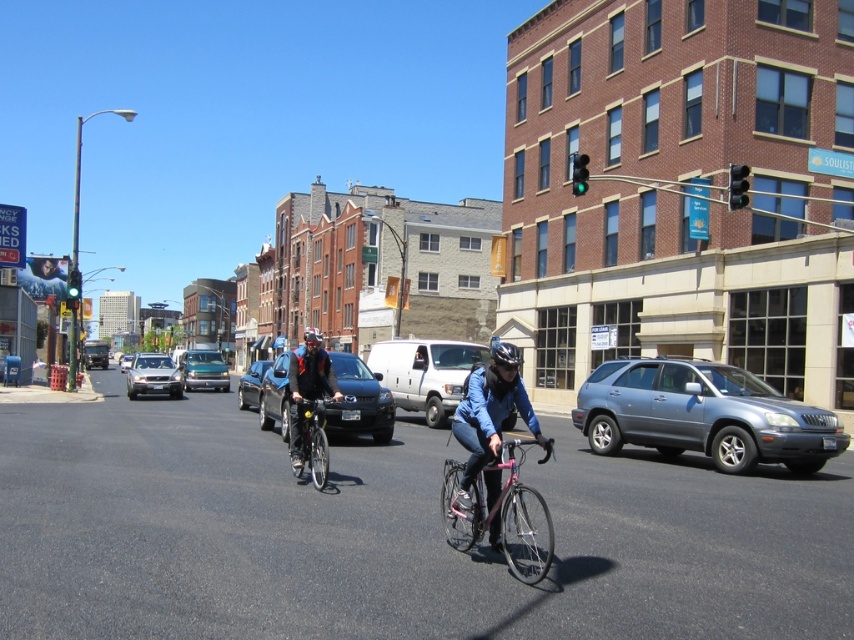
You are a delivery person who needs to secure a package on your shiny metallic bicycle at center. Your black matte bicycle helmet at center is currently on your head. Can you safely place the package between the two without it falling off?

The distance between the shiny metallic bicycle at center and the black matte bicycle helmet at center is 2.16 meters. Since the package would need to be placed between them, there is sufficient space to secure it safely without it falling off.